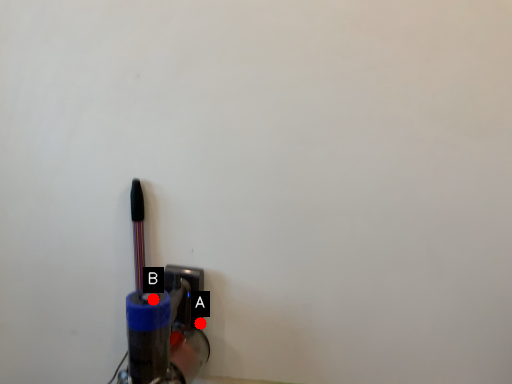
Question: Two points are circled on the image, labeled by A and B beside each circle. Which point appears closest to the camera in this image?

Choices:
 (A) A is closer
 (B) B is closer

Answer: (B)